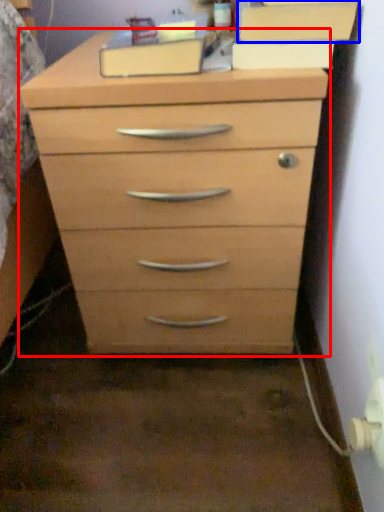
Question: Which object appears closest to the camera in this image, chest of drawers (highlighted by a red box) or cabinetry (highlighted by a blue box)?

Choices:
 (A) chest of drawers
 (B) cabinetry

Answer: (A)